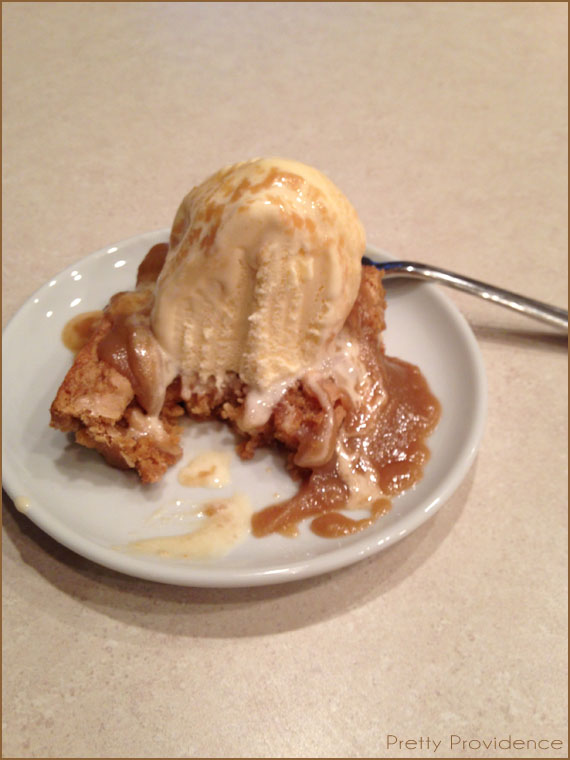
Where is `shadow from the fork/spoon`? The height and width of the screenshot is (760, 570). shadow from the fork/spoon is located at coordinates (530, 337).